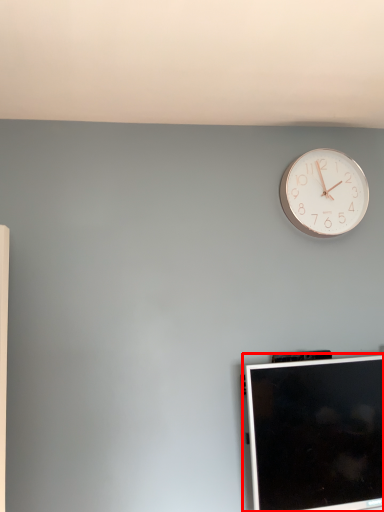
Question: Where is computer monitor (annotated by the red box) located in relation to wall clock in the image?

Choices:
 (A) left
 (B) right

Answer: (A)